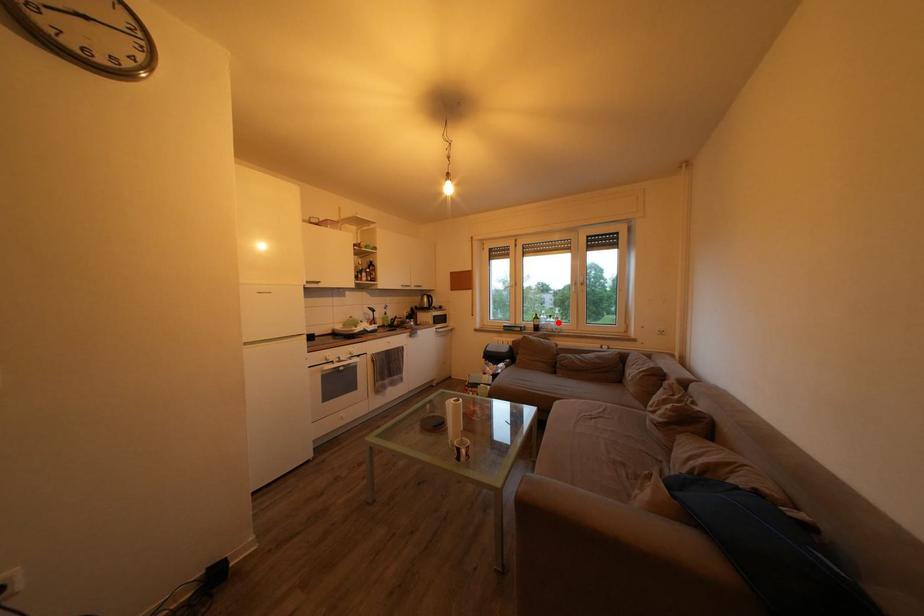
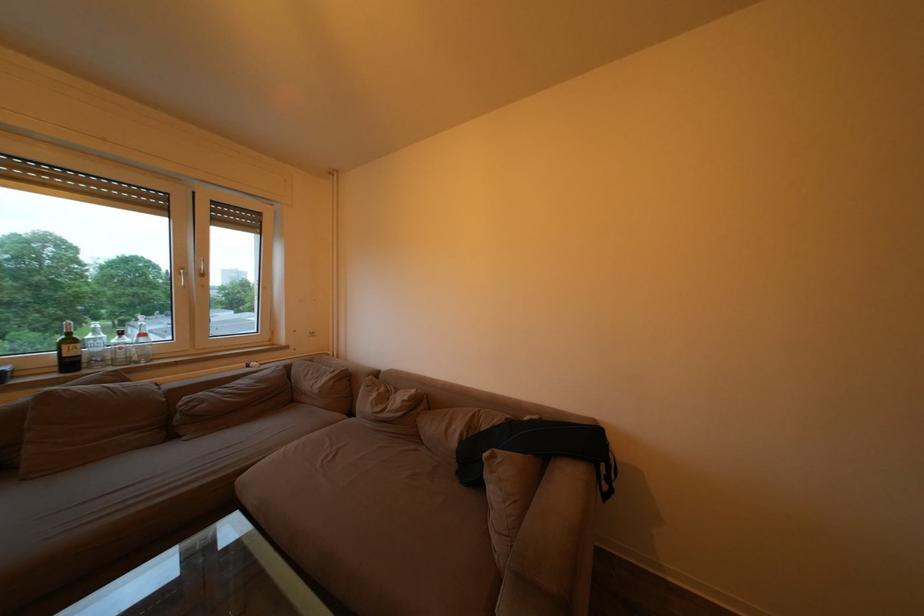
Where in the second image is the point corresponding to the highlighted location from the first image?

(129, 339)